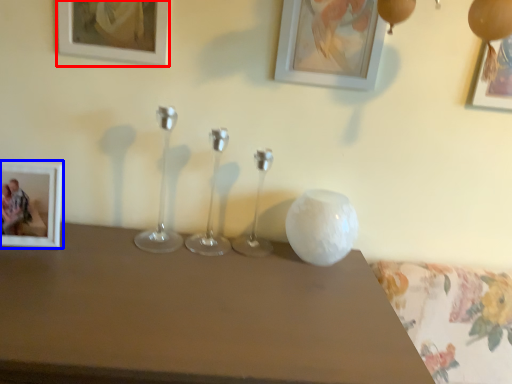
Question: Among these objects, which one is farthest to the camera, picture frame (highlighted by a red box) or picture frame (highlighted by a blue box)?

Choices:
 (A) picture frame
 (B) picture frame

Answer: (B)